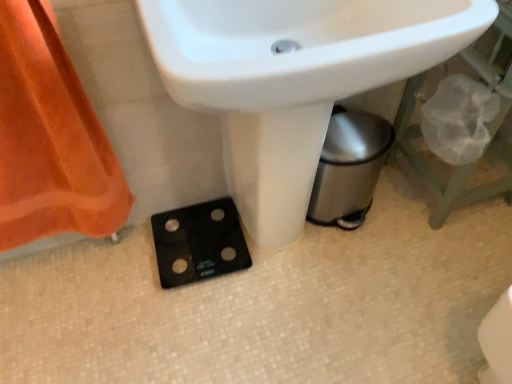
The width and height of the screenshot is (512, 384). Find the location of `free space that is in between black glass scale at lower center and orange fabric at left`. free space that is in between black glass scale at lower center and orange fabric at left is located at coordinates (106, 269).